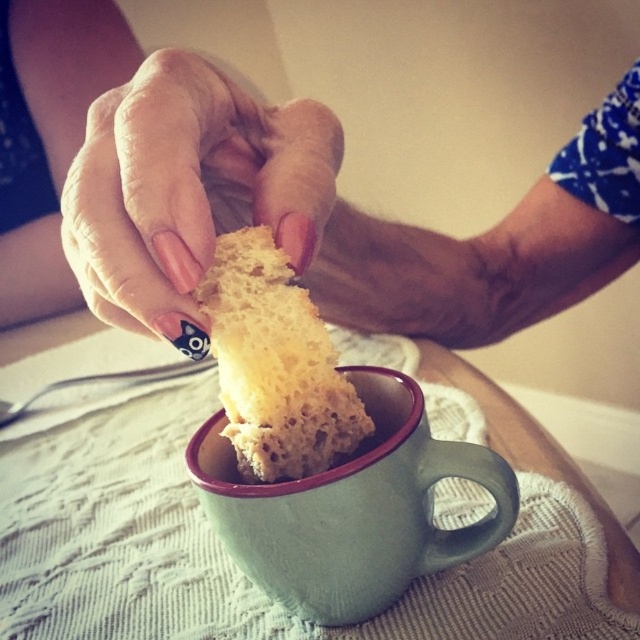
Is matte white bread at upper center closer to the viewer compared to nail polish painted fingernails at upper center?

No, it is not.

Can you confirm if matte white bread at upper center is taller than nail polish painted fingernails at upper center?

Yes, matte white bread at upper center is taller than nail polish painted fingernails at upper center.

Is point (109, 33) behind point (92, 144)?

Yes, it is.

This screenshot has width=640, height=640. I want to click on matte white bread at upper center, so click(257, 204).

Does nail polish painted fingernails at upper center have a larger size compared to spongy yellow bread at center?

Correct, nail polish painted fingernails at upper center is larger in size than spongy yellow bread at center.

Can you confirm if nail polish painted fingernails at upper center is taller than spongy yellow bread at center?

Correct, nail polish painted fingernails at upper center is much taller as spongy yellow bread at center.

Locate an element on the screen. The width and height of the screenshot is (640, 640). nail polish painted fingernails at upper center is located at coordinates (x=186, y=186).

Can you confirm if nail polish painted fingernails at upper center is smaller than green matte mug at center?

No.

Between nail polish painted fingernails at upper center and green matte mug at center, which one has more height?

With more height is nail polish painted fingernails at upper center.

This screenshot has width=640, height=640. In order to click on nail polish painted fingernails at upper center in this screenshot , I will do `click(186, 186)`.

Where is `nail polish painted fingernails at upper center`? This screenshot has width=640, height=640. nail polish painted fingernails at upper center is located at coordinates (186, 186).